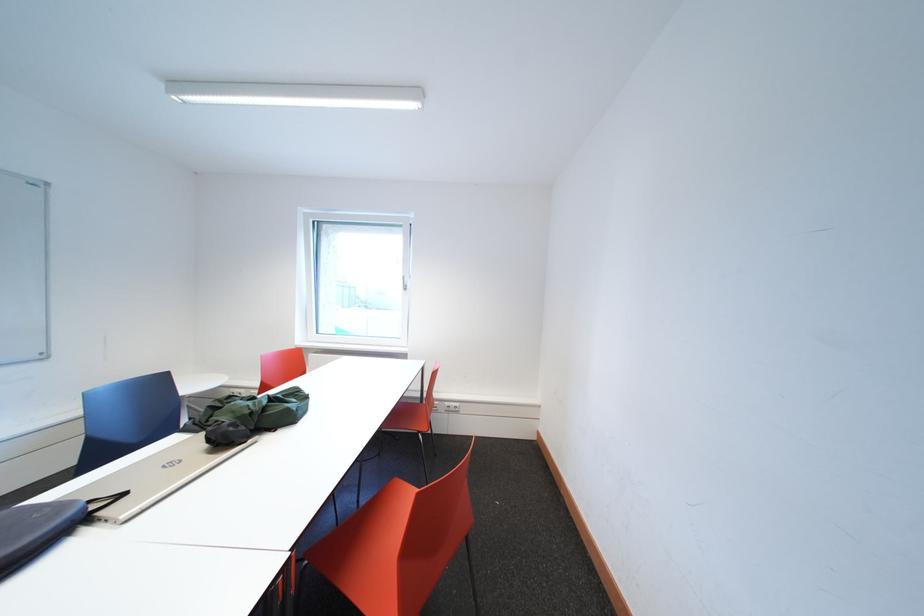
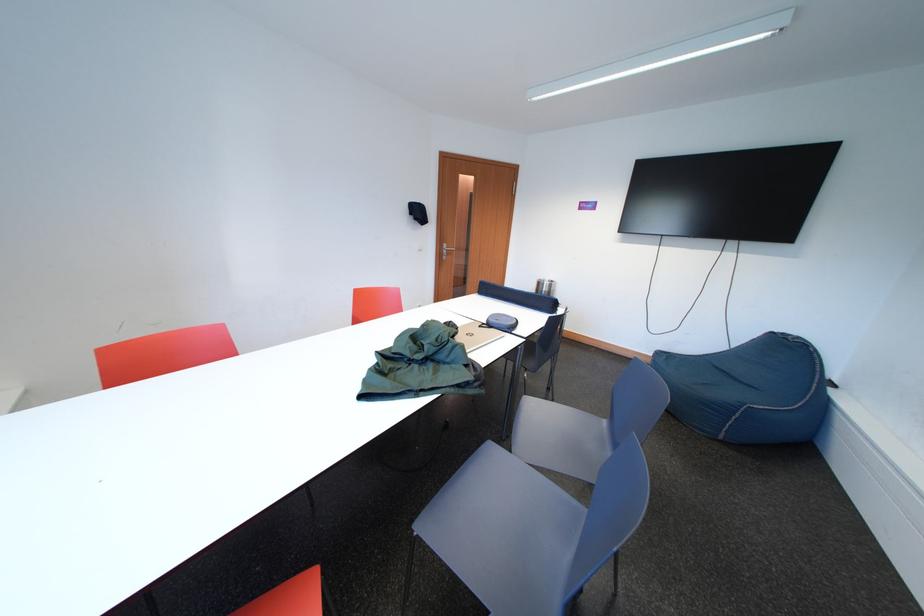
Question: I am providing you with two images of the same scene from different viewpoints. Please identify which objects are invisible in image2.

Choices:
 (A) metal container
 (B) white power outlet
 (C) metal door handle
 (D) green round vase

Answer: (B)